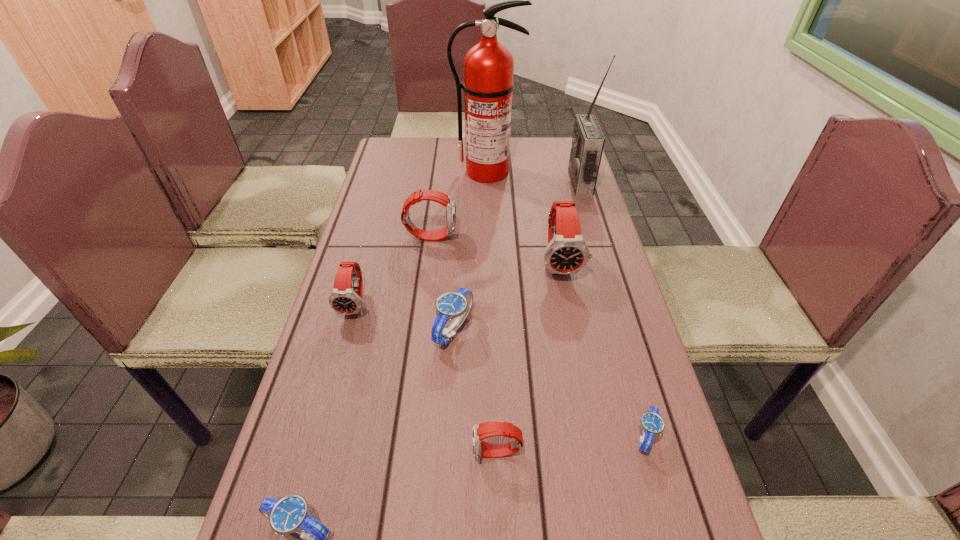
This screenshot has width=960, height=540. Identify the location of the biggest blue watch. (457, 304).

Find the location of a particular element. the second red watch from right to left is located at coordinates (484, 430).

I want to click on the nearest red watch, so click(484, 430).

You are a GUI agent. You are given a task and a screenshot of the screen. Output one action in this format:
    pyautogui.click(x=<x>, y=<y>)
    Task: Click on the shortest watch
    The width and height of the screenshot is (960, 540).
    Given the screenshot: What is the action you would take?
    pyautogui.click(x=652, y=423)

The image size is (960, 540). In order to click on the smallest blue watch in this screenshot , I will do `click(652, 423)`.

You are a GUI agent. You are given a task and a screenshot of the screen. Output one action in this format:
    pyautogui.click(x=<x>, y=<y>)
    Task: Click on the vacant space located at the nozzle of the tallest object
    This screenshot has height=540, width=960.
    Given the screenshot: What is the action you would take?
    click(489, 254)

Find the location of a particular element. The width and height of the screenshot is (960, 540). vacant area situated on the display of the eighth shortest object is located at coordinates (473, 184).

I want to click on free spot located 0.160m on the display of the eighth shortest object, so click(x=523, y=184).

I want to click on vacant space located on the display of the eighth shortest object, so [544, 184].

Where is `vacant space located on the face of the third tallest object`? Image resolution: width=960 pixels, height=540 pixels. vacant space located on the face of the third tallest object is located at coordinates (576, 348).